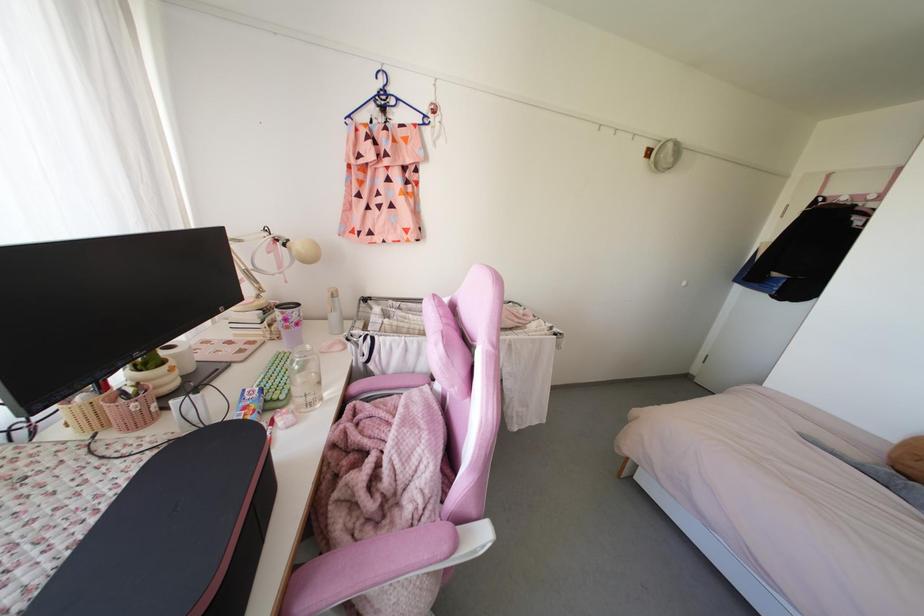
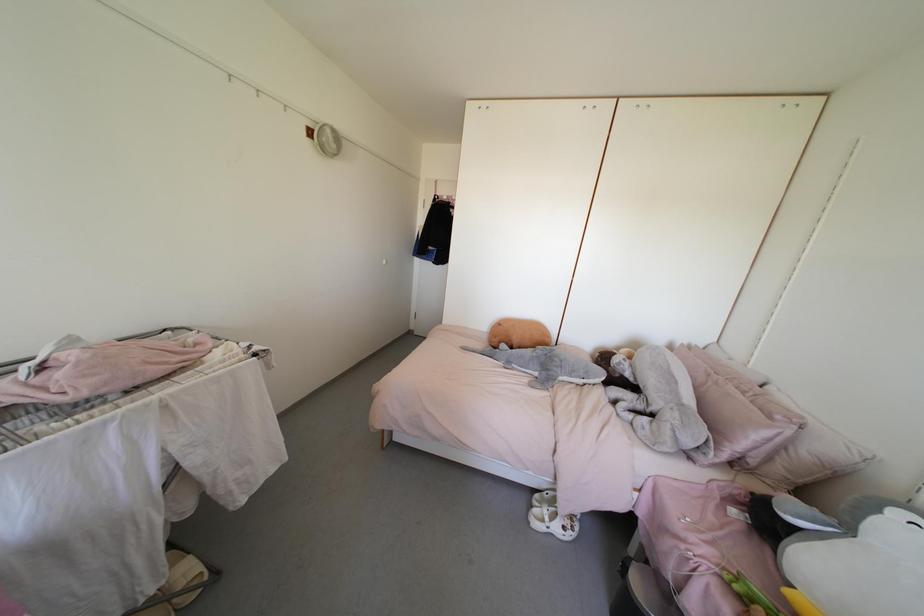
Question: The camera is either moving clockwise (left) or counter-clockwise (right) around the object. The first image is from the beginning of the video and the second image is from the end. Is the camera moving left or right when shooting the video?

Choices:
 (A) Left
 (B) Right

Answer: (A)